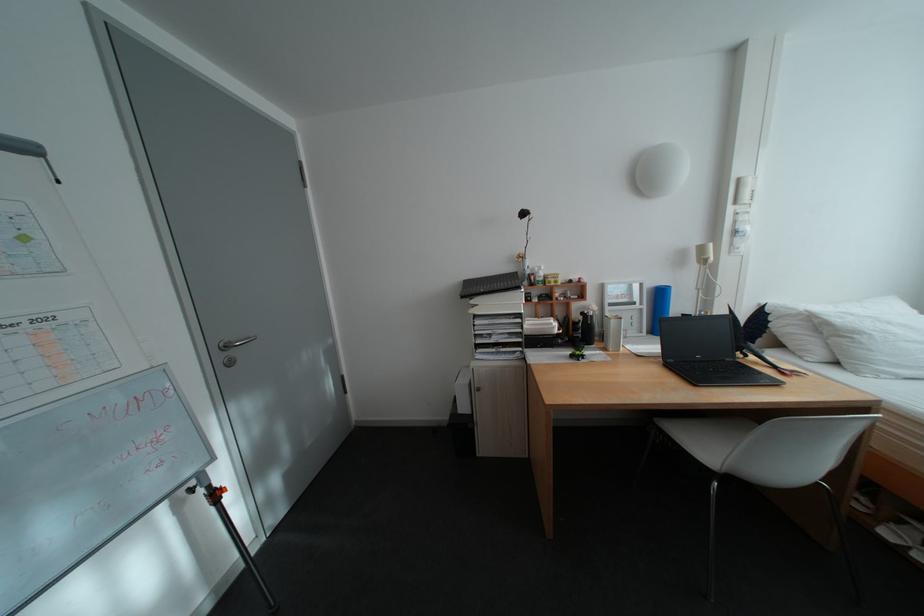
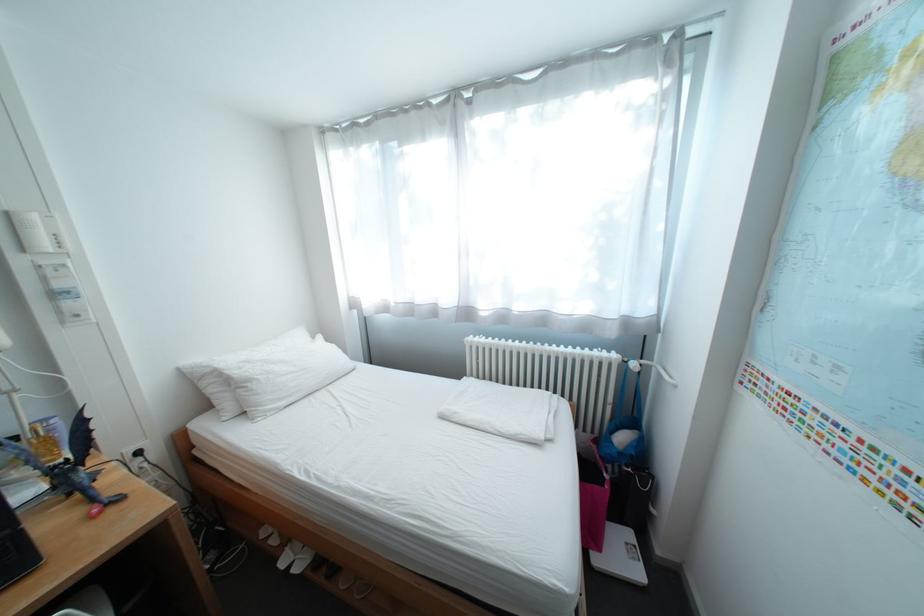
Where in the second image is the point corresponding to the point at 759,357 from the first image?

(81, 495)